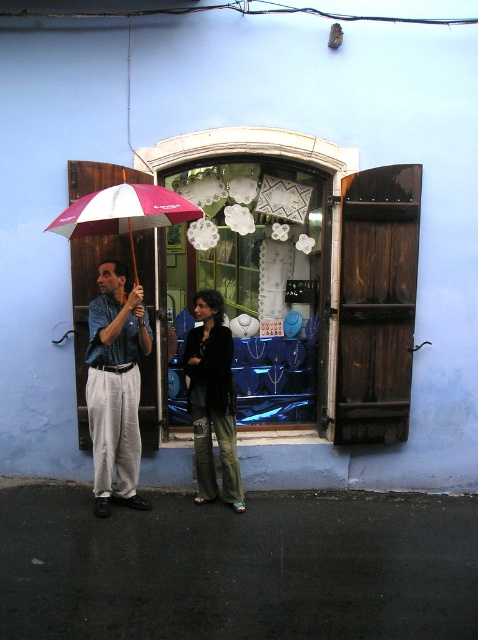
Question: Considering the relative positions of dark brown wooden shutter at right and dark green textured pants at center in the image provided, where is dark brown wooden shutter at right located with respect to dark green textured pants at center?

Choices:
 (A) right
 (B) left

Answer: (A)

Question: Which of the following is the closest to the observer?

Choices:
 (A) (197, 374)
 (B) (148, 189)
 (C) (371, 250)

Answer: (B)

Question: Which point is farther to the camera?

Choices:
 (A) (187, 189)
 (B) (90, 337)
 (C) (63, 218)

Answer: (A)

Question: Is dark brown wooden shutter at right smaller than white and pink fabric umbrella at left?

Choices:
 (A) no
 (B) yes

Answer: (B)

Question: Which of these objects is positioned closest to the dark brown wooden shutter at right?

Choices:
 (A) dark green textured pants at center
 (B) matte glass jewelry at center
 (C) matte blue pants at left
 (D) white and pink fabric umbrella at left

Answer: (B)

Question: Can you confirm if dark brown wooden shutter at right is positioned to the left of matte blue pants at left?

Choices:
 (A) no
 (B) yes

Answer: (A)